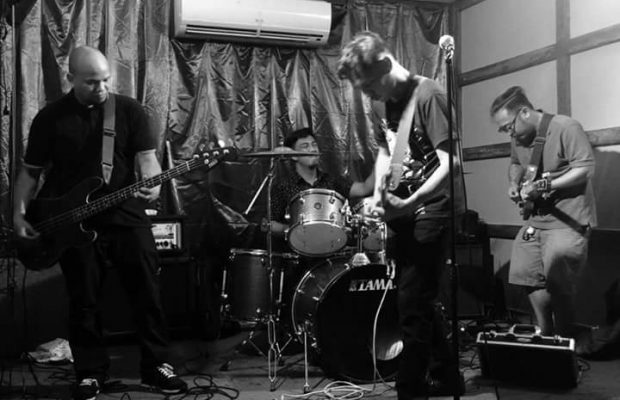
I want to click on a/c, so click(255, 23).